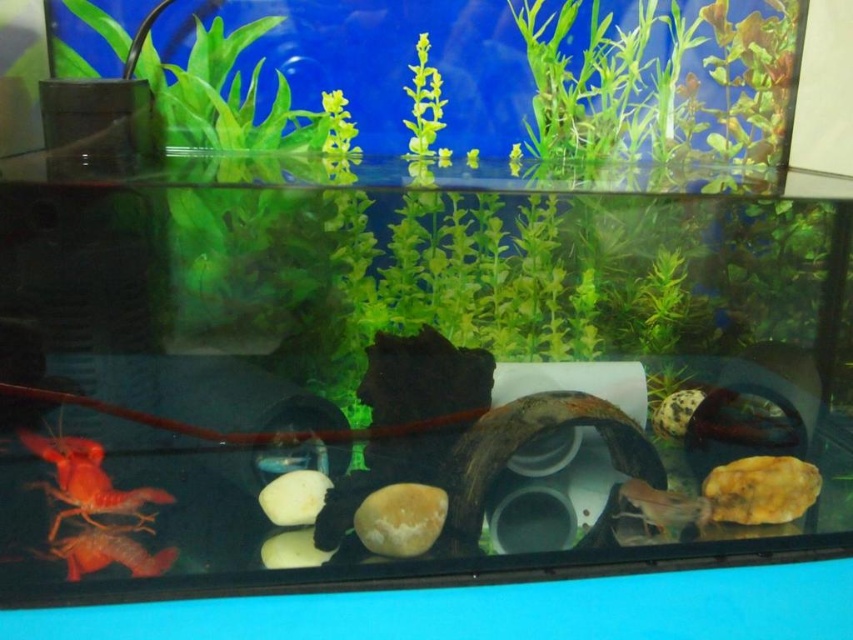
Question: Is green matte plant at upper center wider than matte orange crayfish at lower left?

Choices:
 (A) no
 (B) yes

Answer: (B)

Question: Does green matte plant at upper center have a greater width compared to matte orange crayfish at lower left?

Choices:
 (A) no
 (B) yes

Answer: (B)

Question: Which point is closer to the camera?

Choices:
 (A) translucent glass shrimp at center
 (B) green matte plant at upper center

Answer: (B)

Question: Which is nearer to the matte orange crayfish at lower left?

Choices:
 (A) matte orange shrimp at lower left
 (B) translucent glass shrimp at center
 (C) green matte plant at upper center

Answer: (A)

Question: Where is matte orange crayfish at lower left located in relation to translucent glass shrimp at center in the image?

Choices:
 (A) below
 (B) above

Answer: (B)

Question: Which point is farther to the camera?

Choices:
 (A) (79, 500)
 (B) (691, 499)
 (C) (138, 552)
 (D) (108, 20)

Answer: (D)